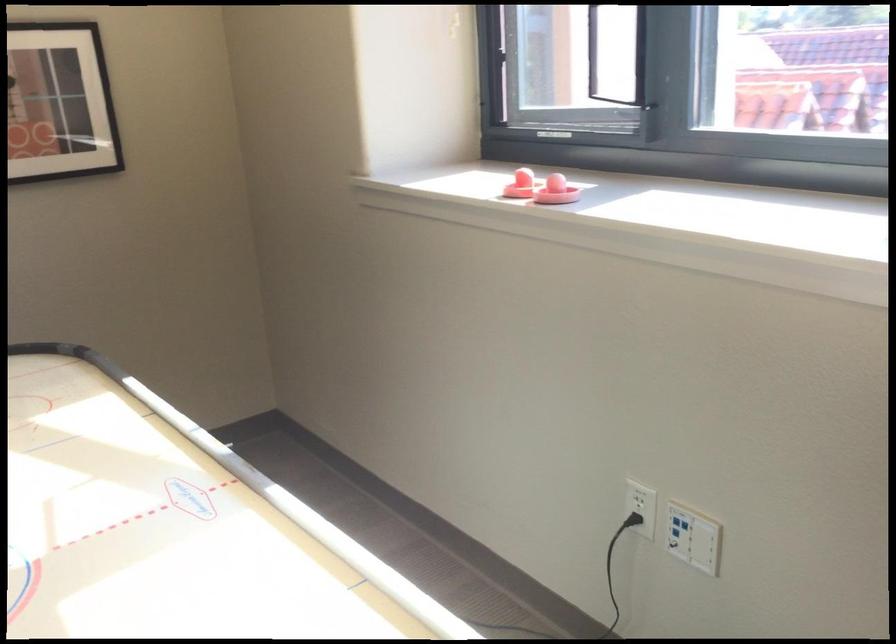
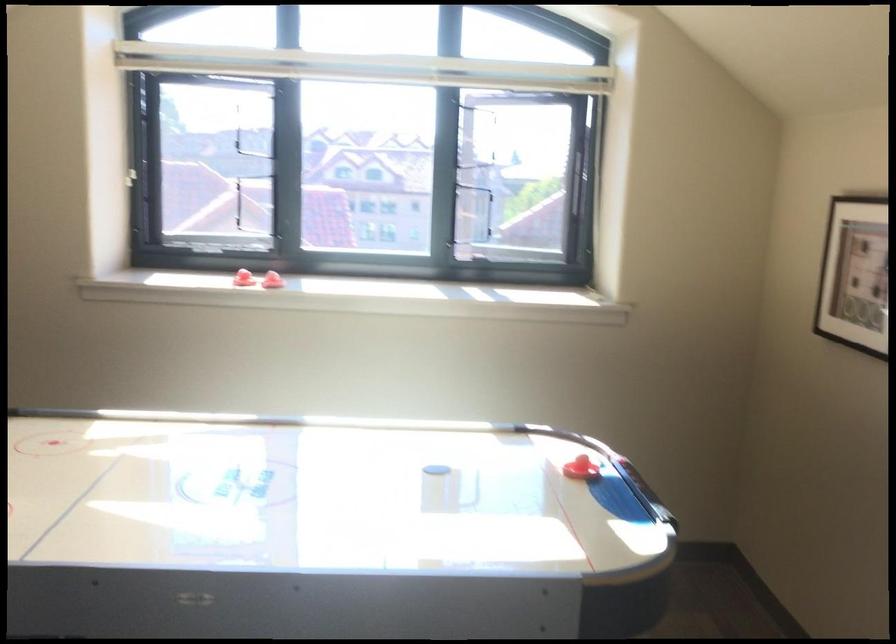
Question: I am providing you with two images of the same scene from different viewpoints. Which of the following objects are not visible in image2?

Choices:
 (A) white wall button
 (B) red air hockey striker
 (C) window latch
 (D) VR headset

Answer: (A)